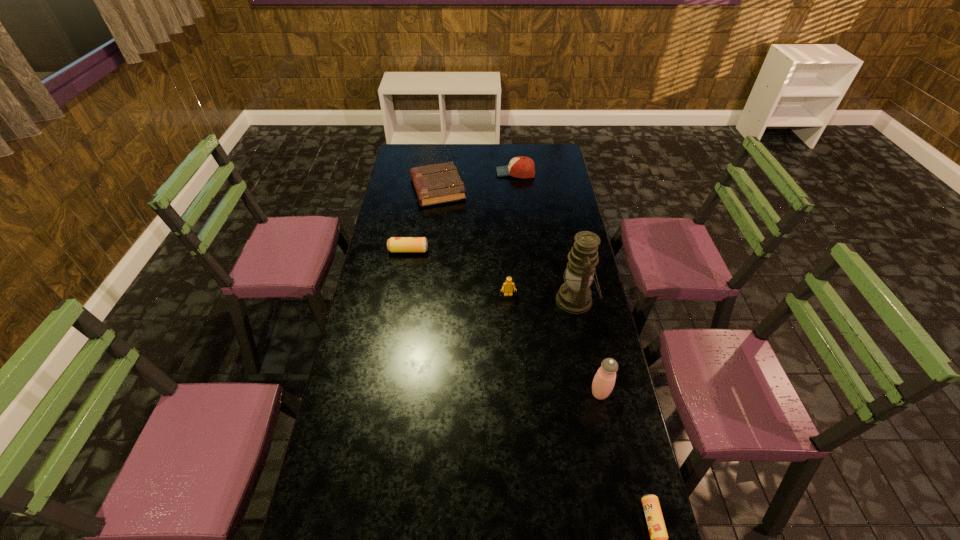
The height and width of the screenshot is (540, 960). I want to click on vacant space located 0.150m on the front-facing side of the baseball cap, so click(468, 173).

What are the coordinates of `vacant space positioned 0.170m on the front-facing side of the baseball cap` in the screenshot? It's located at (464, 173).

I want to click on vacant space situated 0.200m on the front-facing side of the baseball cap, so click(x=458, y=173).

Find the location of a particular element. Image resolution: width=960 pixels, height=540 pixels. free region located on the back of the sixth shortest object is located at coordinates (588, 338).

Find the location of `vacant space located 0.220m on the left of the tallest object`. vacant space located 0.220m on the left of the tallest object is located at coordinates (499, 300).

Where is `free space located 0.160m on the face of the Lego`? free space located 0.160m on the face of the Lego is located at coordinates (511, 331).

Where is `object present at the far edge`? object present at the far edge is located at coordinates (520, 167).

Find the location of a particular element. Image resolution: width=960 pixels, height=540 pixels. beer can that is at the left edge is located at coordinates (395, 244).

Identify the location of hardback book that is at the left edge. This screenshot has width=960, height=540. (439, 183).

Locate an element on the screen. Image resolution: width=960 pixels, height=540 pixels. baseball cap that is at the right edge is located at coordinates (520, 167).